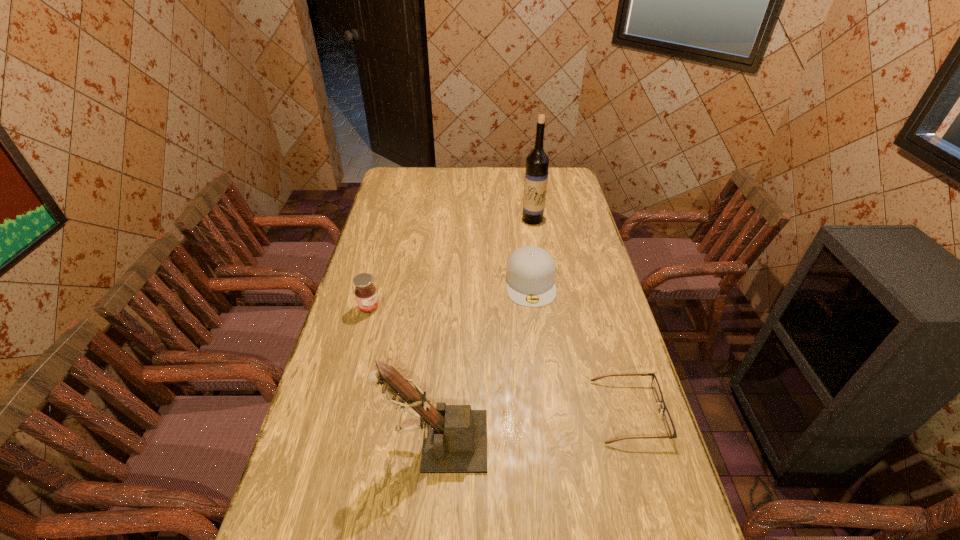
At what (x,y) coordinates should I click in order to perform the action: click on vacant space on the desktop that is between the figurine and the shortest object and is positioned on the label side of the leftmost object. Please return your answer as a coordinate pair (x, y). Looking at the image, I should click on (525, 427).

The width and height of the screenshot is (960, 540). In order to click on vacant spot on the desktop that is between the fourth shortest object and the spectacles and is positioned on the label of the tallest object in this screenshot , I will do `click(530, 427)`.

The width and height of the screenshot is (960, 540). Identify the location of free space on the desktop that is between the second tallest object and the spectacles and is positioned on the front-facing side of the cap. (544, 424).